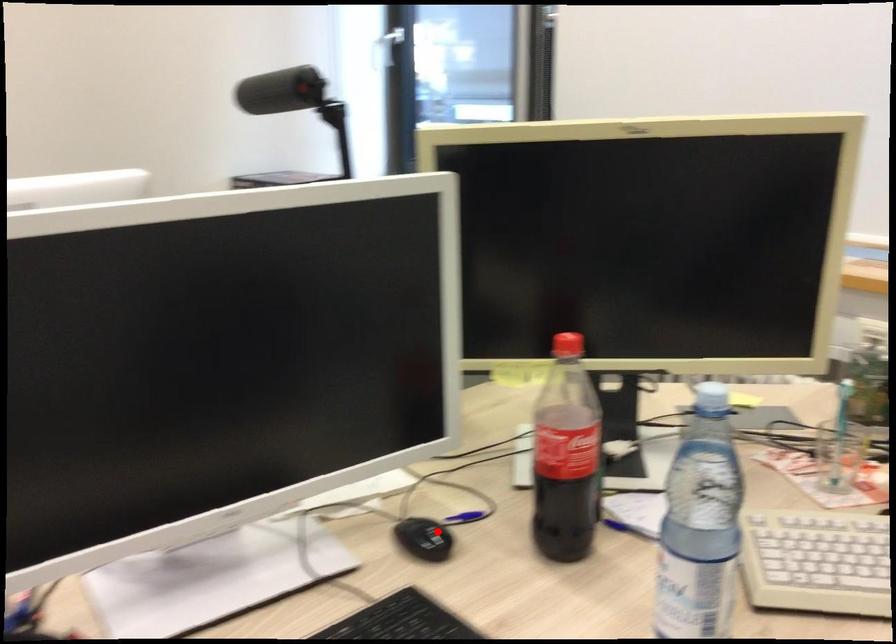
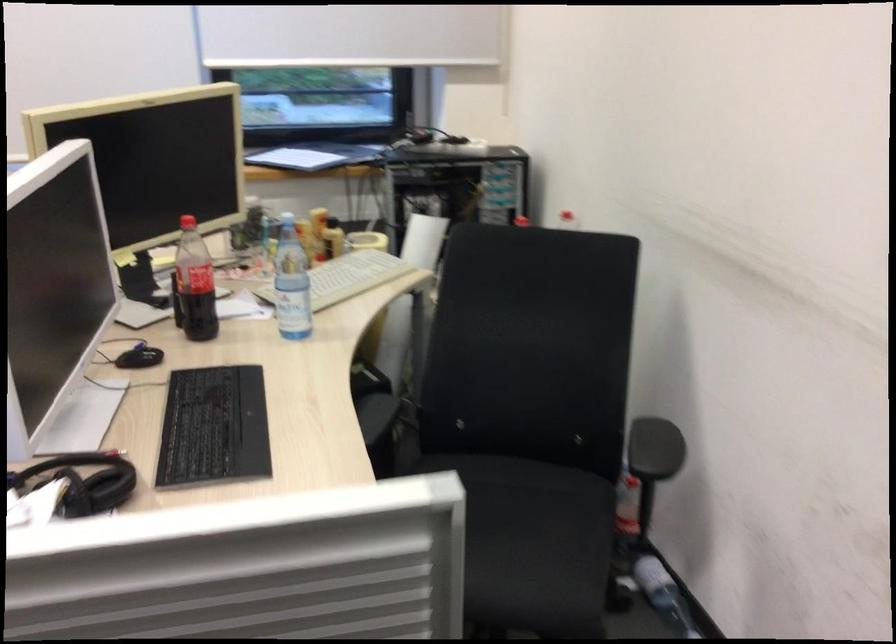
Question: I am providing you with two images of the same scene from different viewpoints. Image1 has a red point marked. In image2, the corresponding 3D location appears at what relative position? Reply with the corresponding letter.

Choices:
 (A) Closer
 (B) Farther

Answer: (B)